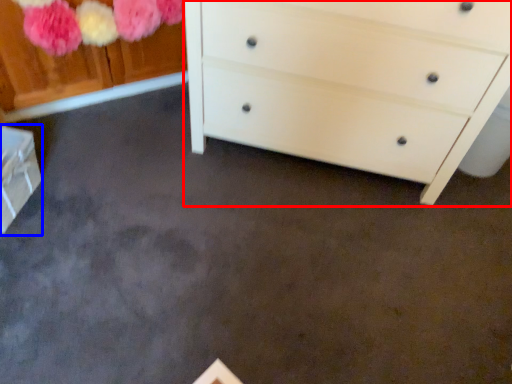
Question: Which object appears farthest to the camera in this image, chest of drawers (highlighted by a red box) or cabinetry (highlighted by a blue box)?

Choices:
 (A) chest of drawers
 (B) cabinetry

Answer: (B)